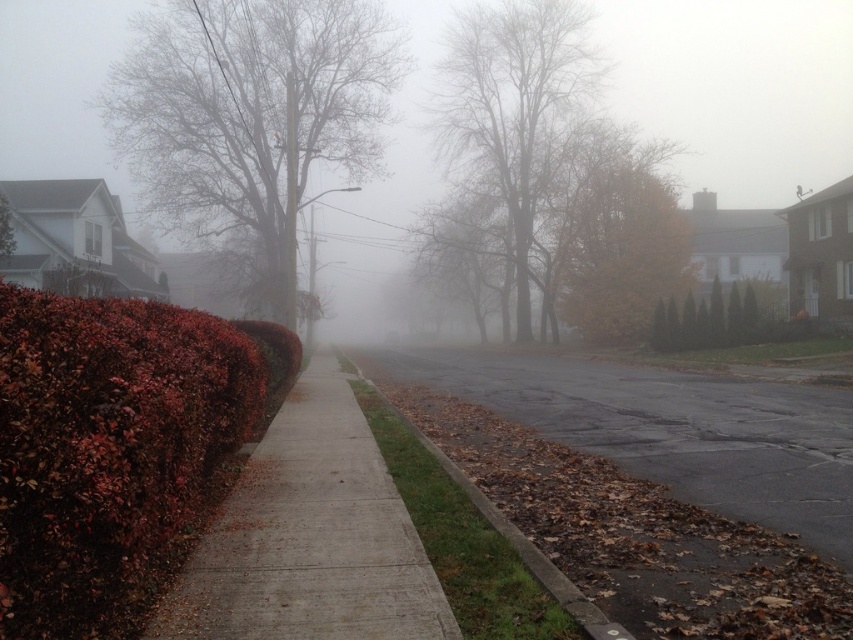
Looking at this image, you are standing at the point closer to the camera in the image. Which point are you at, point (183, 417) or point (550, 566)?

You are at point (183, 417) because it is closer to the camera than point (550, 566).

You are a gardener who needs to place a new decorative stone along the sidewalk. The stone requires a space wider than the shiny red hedge at left. Can the brown concrete curb at lower center provide enough space for it?

The shiny red hedge at left is narrower than the brown concrete curb at lower center. Since the stone needs a space wider than the hedge, the brown concrete curb at lower center can accommodate it because its width is greater than the hedge.